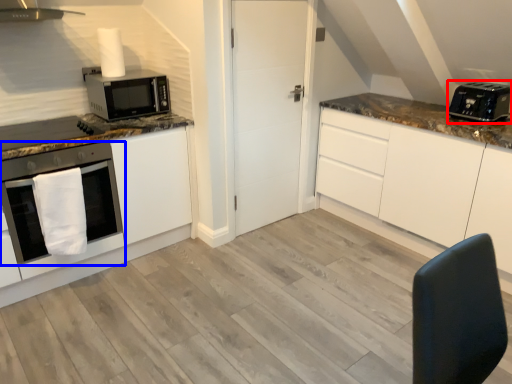
Question: Which object appears closest to the camera in this image, toaster (highlighted by a red box) or oven (highlighted by a blue box)?

Choices:
 (A) toaster
 (B) oven

Answer: (B)